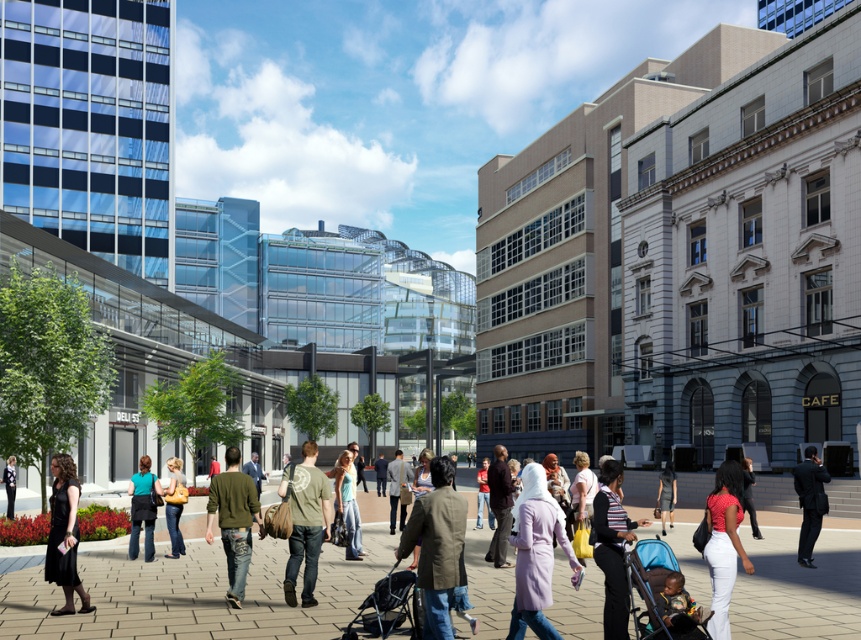
Between khaki fabric jacket at center and dark suit at lower right, which one has less height?

Standing shorter between the two is khaki fabric jacket at center.

Who is higher up, khaki fabric jacket at center or dark suit at lower right?

khaki fabric jacket at center is above.

Is point (447, 604) more distant than point (827, 506)?

That is False.

This screenshot has width=861, height=640. Identify the location of khaki fabric jacket at center. (437, 547).

Is the position of purple fabric coat at center less distant than that of green denim jeans at center?

Yes, purple fabric coat at center is closer to the viewer.

This screenshot has width=861, height=640. What do you see at coordinates (536, 554) in the screenshot?
I see `purple fabric coat at center` at bounding box center [536, 554].

Image resolution: width=861 pixels, height=640 pixels. What are the coordinates of `purple fabric coat at center` in the screenshot? It's located at [536, 554].

Is point (717, 506) closer to viewer compared to point (387, 632)?

Yes, it is in front of point (387, 632).

Between matte pink top at center and black fabric baby carriage at center, which one has more height?

matte pink top at center

Where is `matte pink top at center`? matte pink top at center is located at coordinates (723, 544).